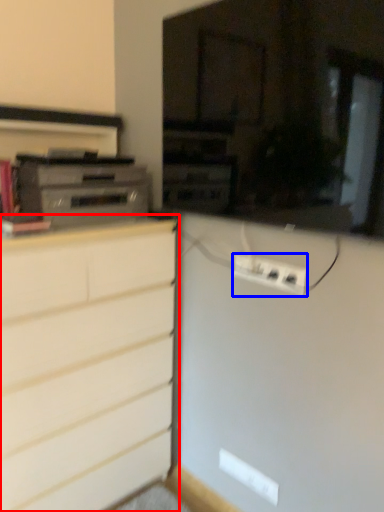
Question: Which object is further to the camera taking this photo, chest of drawers (highlighted by a red box) or electric outlet (highlighted by a blue box)?

Choices:
 (A) chest of drawers
 (B) electric outlet

Answer: (B)